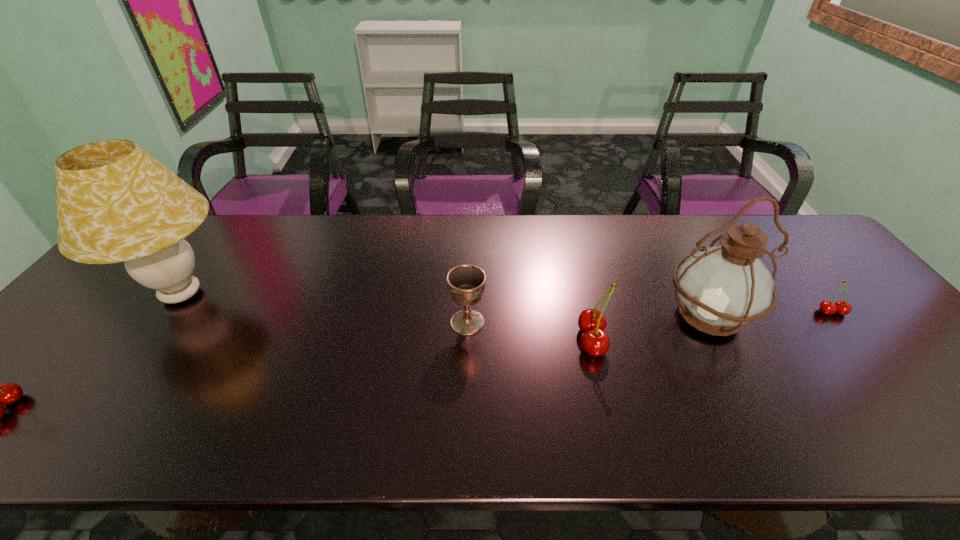
Image resolution: width=960 pixels, height=540 pixels. I want to click on free space for an extra cherry to achieve even spacing, so click(319, 373).